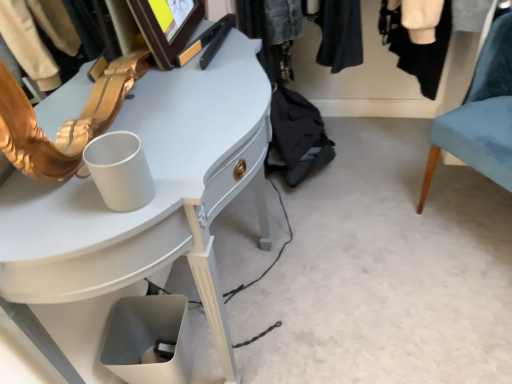
Where is `vacant region under velvet teal chair at right (from a real-world perspective)`? Image resolution: width=512 pixels, height=384 pixels. vacant region under velvet teal chair at right (from a real-world perspective) is located at coordinates (476, 218).